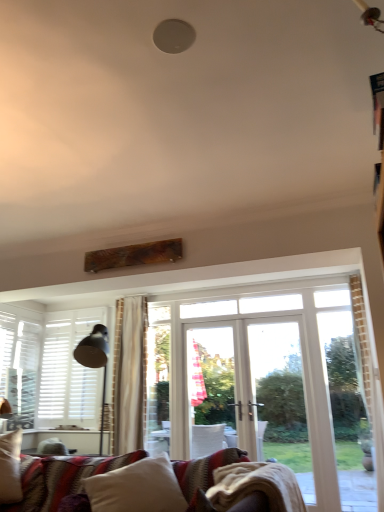
Question: From a real-world perspective, is white matte shutters at left physically located above or below white soft pillow at lower center?

Choices:
 (A) above
 (B) below

Answer: (A)

Question: Is white matte shutters at left taller or shorter than white soft pillow at lower center?

Choices:
 (A) tall
 (B) short

Answer: (A)

Question: In terms of size, does white matte shutters at left appear bigger or smaller than white soft pillow at lower center?

Choices:
 (A) big
 (B) small

Answer: (B)

Question: Would you say white soft pillow at lower center is to the left or to the right of white matte shutters at left in the picture?

Choices:
 (A) right
 (B) left

Answer: (A)

Question: From a real-world perspective, is white soft pillow at lower center above or below white matte shutters at left?

Choices:
 (A) above
 (B) below

Answer: (B)

Question: Is white soft pillow at lower center wider or thinner than white matte shutters at left?

Choices:
 (A) thin
 (B) wide

Answer: (B)

Question: Relative to white matte shutters at left, is white soft pillow at lower center in front or behind?

Choices:
 (A) front
 (B) behind

Answer: (A)